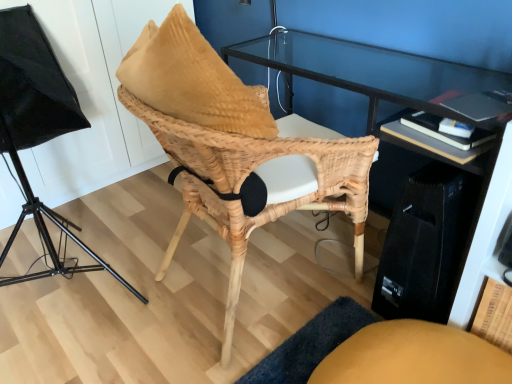
Where is `free spot below black fabric lampshade at left (from a real-world perspective)`? free spot below black fabric lampshade at left (from a real-world perspective) is located at coordinates tap(67, 272).